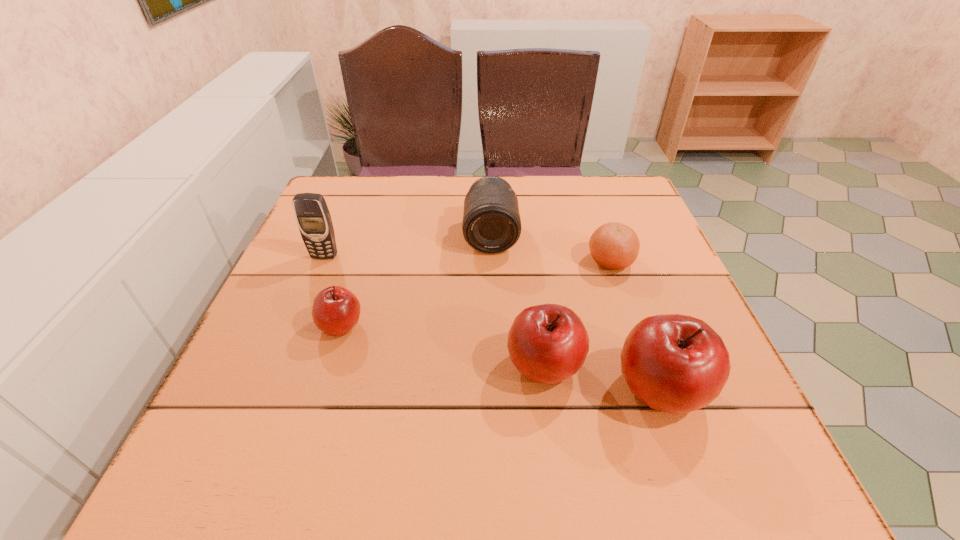
Where is `free space located 0.310m on the surface of the telephoto lens`? The height and width of the screenshot is (540, 960). free space located 0.310m on the surface of the telephoto lens is located at coordinates (x=494, y=364).

The width and height of the screenshot is (960, 540). I want to click on vacant space located on the front face of the cellular telephone, so click(x=285, y=354).

The width and height of the screenshot is (960, 540). In order to click on vacant space located on the back of the clementine in this screenshot , I will do `click(585, 186)`.

The height and width of the screenshot is (540, 960). In order to click on object that is at the far edge in this screenshot , I will do `click(491, 224)`.

Image resolution: width=960 pixels, height=540 pixels. I want to click on apple present at the left edge, so click(x=336, y=310).

This screenshot has width=960, height=540. Identify the location of cellular telephone present at the left edge. (313, 218).

Locate an element on the screen. apple at the right edge is located at coordinates (675, 363).

The width and height of the screenshot is (960, 540). Find the location of `clementine that is at the right edge`. clementine that is at the right edge is located at coordinates (615, 246).

Find the location of a particular element. The width and height of the screenshot is (960, 540). object that is at the near right corner is located at coordinates (675, 363).

Find the location of a particular element. This screenshot has width=960, height=540. free location at the far edge of the desktop is located at coordinates pos(562,189).